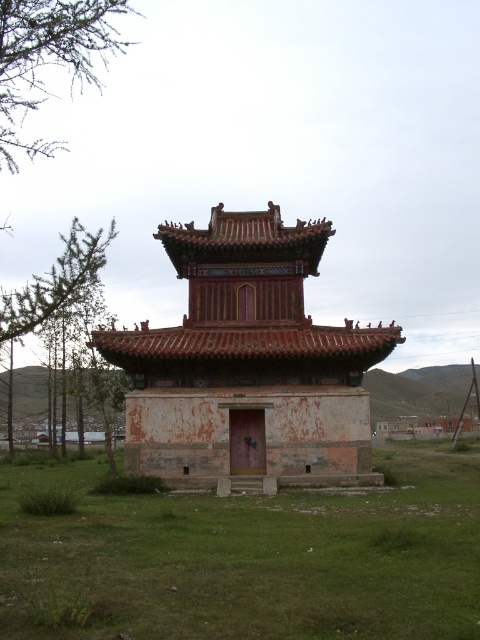
You are standing in front of the traditional structure and want to place a picnic blanket. The green grass at center and the green leafy tree at upper left are visible. Which area would be more suitable for placing the blanket, considering the size of the grassy area?

The green grass at center has a smaller size compared to the green leafy tree at upper left, so the area around the green leafy tree at upper left might offer more space for placing the picnic blanket.

You are standing in front of the traditional pavilion and notice the green grass at center and the green leafy tree at upper left. Which object is located to the left of the other?

The green grass at center is positioned on the right side of green leafy tree at upper left, so the green leafy tree at upper left is to the left of the green grass at center.

You are standing in front of the traditional pavilion and notice two points marked on the structure. The first point is at coordinate point (124, 547) and the second is at point (48, 64). Which point is nearer to your current position?

Point (124, 547) is closer to the camera than point (48, 64), so the first point is nearer to your current position.